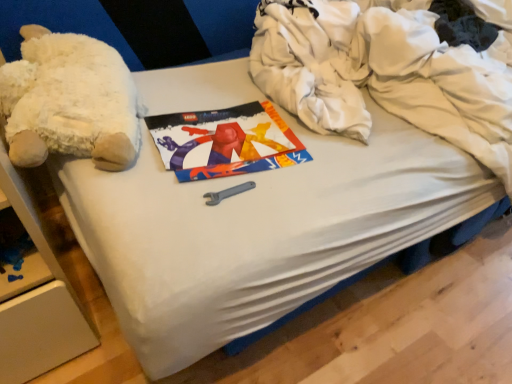
Question: Based on their positions, is white cotton clothing at upper right located to the left or right of white plush at left?

Choices:
 (A) left
 (B) right

Answer: (B)

Question: In the image, is white cotton clothing at upper right positioned in front of or behind white plush at left?

Choices:
 (A) front
 (B) behind

Answer: (A)

Question: In terms of height, does white cotton clothing at upper right look taller or shorter compared to white plush at left?

Choices:
 (A) tall
 (B) short

Answer: (A)

Question: Is white plush at left in front of or behind white cotton clothing at upper right in the image?

Choices:
 (A) behind
 (B) front

Answer: (A)

Question: In terms of height, does white plush at left look taller or shorter compared to white cotton clothing at upper right?

Choices:
 (A) short
 (B) tall

Answer: (A)

Question: In terms of size, does white plush at left appear bigger or smaller than white cotton clothing at upper right?

Choices:
 (A) big
 (B) small

Answer: (B)

Question: From the image's perspective, is white plush at left located above or below white cotton clothing at upper right?

Choices:
 (A) above
 (B) below

Answer: (B)